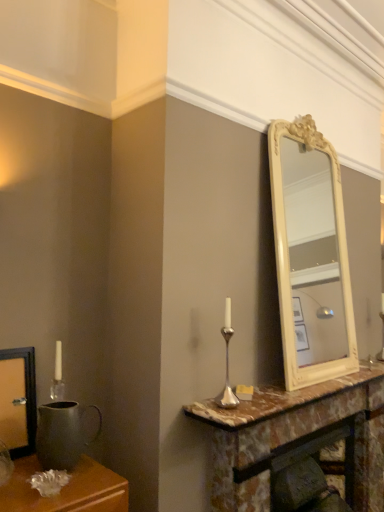
Question: Is silver metallic candle holder at center positioned in front of marble fireplace at center?

Choices:
 (A) no
 (B) yes

Answer: (B)

Question: Does silver metallic candle holder at center have a larger size compared to marble fireplace at center?

Choices:
 (A) yes
 (B) no

Answer: (B)

Question: Is silver metallic candle holder at center further to camera compared to marble fireplace at center?

Choices:
 (A) no
 (B) yes

Answer: (A)

Question: Is silver metallic candle holder at center positioned far away from marble fireplace at center?

Choices:
 (A) yes
 (B) no

Answer: (B)

Question: Is silver metallic candle holder at center placed right next to marble fireplace at center?

Choices:
 (A) yes
 (B) no

Answer: (B)

Question: From the image's perspective, would you say silver metallic candle holder at center is positioned over marble fireplace at center?

Choices:
 (A) no
 (B) yes

Answer: (B)

Question: Is matte metal pitcher at left not inside silver metallic candle holder at center?

Choices:
 (A) no
 (B) yes

Answer: (B)

Question: From the image's perspective, would you say matte metal pitcher at left is shown under silver metallic candle holder at center?

Choices:
 (A) yes
 (B) no

Answer: (A)

Question: Could silver metallic candle holder at center be considered to be inside matte metal pitcher at left?

Choices:
 (A) no
 (B) yes

Answer: (A)

Question: From a real-world perspective, is matte metal pitcher at left under silver metallic candle holder at center?

Choices:
 (A) yes
 (B) no

Answer: (A)

Question: Can you confirm if matte metal pitcher at left is positioned to the left of silver metallic candle holder at center?

Choices:
 (A) no
 (B) yes

Answer: (B)

Question: From a real-world perspective, is matte metal pitcher at left over silver metallic candle holder at center?

Choices:
 (A) yes
 (B) no

Answer: (B)

Question: Can you confirm if matte metal pitcher at left is shorter than marble at center?

Choices:
 (A) yes
 (B) no

Answer: (B)